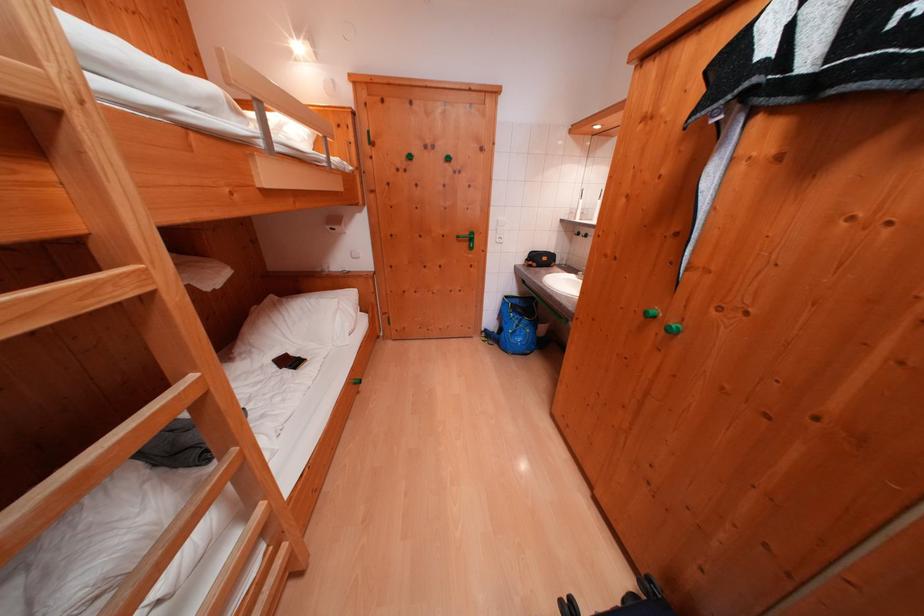
Where would you push the green door handle? Please return your answer as a coordinate pair (x, y).

(468, 238)